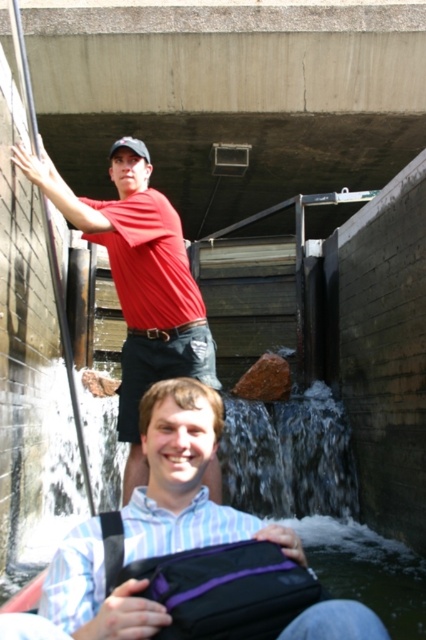
Question: Estimate the real-world distances between objects in this image. Which object is closer to the matte black baseball cap at upper center?

Choices:
 (A) matte red shirt at upper left
 (B) clear water at center
 (C) striped cotton shirt at lower center

Answer: (A)

Question: Is clear water at center wider than matte black baseball cap at upper center?

Choices:
 (A) no
 (B) yes

Answer: (B)

Question: Which point appears farthest from the camera in this image?

Choices:
 (A) (55, 620)
 (B) (146, 150)
 (C) (141, 224)
 (D) (313, 504)

Answer: (D)

Question: Is the position of clear water at center more distant than that of matte black baseball cap at upper center?

Choices:
 (A) no
 (B) yes

Answer: (A)

Question: Is clear water at center to the left of matte red shirt at upper left from the viewer's perspective?

Choices:
 (A) yes
 (B) no

Answer: (B)

Question: Which is farther from the matte red shirt at upper left?

Choices:
 (A) matte black baseball cap at upper center
 (B) clear water at center

Answer: (B)